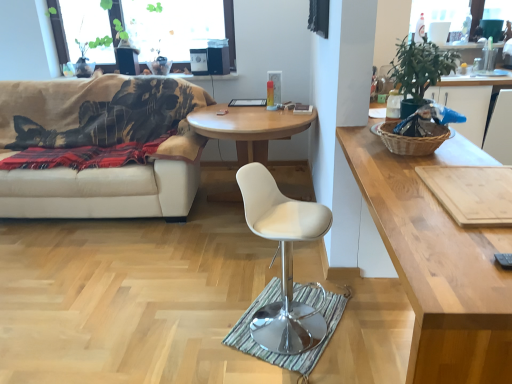
The width and height of the screenshot is (512, 384). What are the coordinates of `light brown wooden cutting board at right, the first coffee table in the right-to-left sequence` in the screenshot? It's located at (438, 263).

The image size is (512, 384). What do you see at coordinates (413, 139) in the screenshot?
I see `brown woven picnic basket at right` at bounding box center [413, 139].

Where is `brown woven picnic basket at right`? This screenshot has width=512, height=384. brown woven picnic basket at right is located at coordinates (413, 139).

The image size is (512, 384). Describe the element at coordinates (297, 301) in the screenshot. I see `textured woven mat at center` at that location.

What do you see at coordinates (230, 30) in the screenshot? The height and width of the screenshot is (384, 512). I see `transparent glass window at upper center` at bounding box center [230, 30].

I want to click on green leafy plant at upper right, so click(419, 71).

Describe the element at coordinates (419, 71) in the screenshot. I see `green leafy plant at upper right` at that location.

At what (x,y) coordinates should I click in order to perform the action: click on white leather stool at center. Please return your answer as a coordinate pair (x, y). The height and width of the screenshot is (384, 512). Looking at the image, I should click on (283, 260).

From a real-world perspective, which object rests below the other?

textured woven mat at center.

From the picture: Between white leather stool at center and textured woven mat at center, which one has less height?

textured woven mat at center is shorter.

From the image's perspective, is white leather stool at center over textured woven mat at center?

Indeed, from the image's perspective, white leather stool at center is shown above textured woven mat at center.

Which of these two, white leather stool at center or textured woven mat at center, is thinner?

Thinner between the two is white leather stool at center.

Is wooden round table at center, which ranks as the first coffee table in back-to-front order, situated inside transparent glass window at upper center or outside?

wooden round table at center, which ranks as the first coffee table in back-to-front order, cannot be found inside transparent glass window at upper center.

Considering the positions of objects wooden round table at center, which ranks as the first coffee table in back-to-front order, and transparent glass window at upper center in the image provided, who is more to the right, wooden round table at center, which ranks as the first coffee table in back-to-front order, or transparent glass window at upper center?

wooden round table at center, which ranks as the first coffee table in back-to-front order, is more to the right.

Looking at this image, does wooden round table at center, the second coffee table viewed from the right, have a lesser height compared to transparent glass window at upper center?

In fact, wooden round table at center, the second coffee table viewed from the right, may be taller than transparent glass window at upper center.

Locate an element on the screen. This screenshot has height=384, width=512. window screen above the wooden round table at center, the 1th coffee table viewed from the left (from the image's perspective) is located at coordinates (230, 30).

Where is `houseplant above the textured woven mat at center (from the image's perspective)`? The width and height of the screenshot is (512, 384). houseplant above the textured woven mat at center (from the image's perspective) is located at coordinates pos(419,71).

Between textured woven mat at center and green leafy plant at upper right, which one is positioned behind?

textured woven mat at center is behind.

Can you confirm if textured woven mat at center is positioned to the left of green leafy plant at upper right?

Yes.

Is green leafy plant at upper right located within textured woven mat at center?

No, green leafy plant at upper right is not inside textured woven mat at center.

From the image's perspective, would you say light brown wooden cutting board at right, the first coffee table in the right-to-left sequence, is positioned over wooden cutting board at right?

Actually, light brown wooden cutting board at right, the first coffee table in the right-to-left sequence, appears below wooden cutting board at right in the image.

From a real-world perspective, is light brown wooden cutting board at right, the first coffee table in the right-to-left sequence, physically located above or below wooden cutting board at right?

light brown wooden cutting board at right, the first coffee table in the right-to-left sequence, is situated lower than wooden cutting board at right in the real world.

Can you see light brown wooden cutting board at right, acting as the second coffee table starting from the left, touching wooden cutting board at right?

light brown wooden cutting board at right, acting as the second coffee table starting from the left, is not next to wooden cutting board at right, and they're not touching.

Is point (462, 307) farther from camera compared to point (450, 186)?

No, it is in front of (450, 186).

Is transparent glass window at upper center taller or shorter than beige fabric couch at left?

Clearly, transparent glass window at upper center is shorter compared to beige fabric couch at left.

Where is `studio couch below the transparent glass window at upper center (from a real-world perspective)`? The width and height of the screenshot is (512, 384). studio couch below the transparent glass window at upper center (from a real-world perspective) is located at coordinates (102, 145).

Does transparent glass window at upper center have a larger size compared to beige fabric couch at left?

Actually, transparent glass window at upper center might be smaller than beige fabric couch at left.

Looking at this image, is transparent glass window at upper center in front of or behind beige fabric couch at left in the image?

transparent glass window at upper center is behind beige fabric couch at left.

Which is more to the left, wooden cutting board at right or textured woven mat at center?

textured woven mat at center.

From the image's perspective, is wooden cutting board at right positioned above or below textured woven mat at center?

From the image's perspective, wooden cutting board at right appears above textured woven mat at center.

Is wooden cutting board at right in front of or behind textured woven mat at center in the image?

Clearly, wooden cutting board at right is in front of textured woven mat at center.

Is beige fabric couch at left in contact with brown woven picnic basket at right?

No, beige fabric couch at left is not touching brown woven picnic basket at right.

Is beige fabric couch at left bigger or smaller than brown woven picnic basket at right?

Considering their sizes, beige fabric couch at left takes up more space than brown woven picnic basket at right.

Between beige fabric couch at left and brown woven picnic basket at right, which one has more height?

beige fabric couch at left is taller.

Considering the positions of points (71, 181) and (410, 148), is point (71, 181) closer to camera compared to point (410, 148)?

No, (71, 181) is behind (410, 148).

The image size is (512, 384). What are the coordinates of `mat that appears on the right of white leather stool at center` in the screenshot? It's located at (297, 301).

I want to click on coffee table that is the 1st object located below the transparent glass window at upper center (from the image's perspective), so click(249, 128).

When comparing their distances from brown woven picnic basket at right, does wooden cutting board at right or wooden round table at center, which ranks as the first coffee table in back-to-front order, seem closer?

Based on the image, wooden cutting board at right appears to be nearer to brown woven picnic basket at right.

Based on their spatial positions, is brown woven picnic basket at right or wooden cutting board at right further from wooden round table at center, which ranks as the first coffee table in back-to-front order?

Among the two, wooden cutting board at right is located further to wooden round table at center, which ranks as the first coffee table in back-to-front order.

From the image, which object appears to be farther from wooden round table at center, the 1th coffee table viewed from the left, green leafy plant at upper right or textured woven mat at center?

textured woven mat at center.

Looking at the image, which one is located further to wooden cutting board at right, light brown wooden cutting board at right, which ranks as the 1th coffee table in front-to-back order, or brown woven picnic basket at right?

brown woven picnic basket at right is further to wooden cutting board at right.

Estimate the real-world distances between objects in this image. Which object is closer to wooden cutting board at right, textured woven mat at center or green leafy plant at upper right?

The object closer to wooden cutting board at right is green leafy plant at upper right.

From the image, which object appears to be nearer to beige fabric couch at left, transparent glass window at upper center or green leafy plant at upper right?

Among the two, transparent glass window at upper center is located nearer to beige fabric couch at left.

Which object lies nearer to the anchor point wooden round table at center, which ranks as the first coffee table in back-to-front order, brown woven picnic basket at right or transparent glass window at upper center?

The object closer to wooden round table at center, which ranks as the first coffee table in back-to-front order, is transparent glass window at upper center.

From the image, which object appears to be farther from wooden cutting board at right, wooden round table at center, which ranks as the first coffee table in back-to-front order, or transparent glass window at upper center?

Among the two, transparent glass window at upper center is located further to wooden cutting board at right.

Locate an element on the screen. picnic basket positioned between wooden cutting board at right and green leafy plant at upper right from near to far is located at coordinates 413,139.

You are a GUI agent. You are given a task and a screenshot of the screen. Output one action in this format:
    pyautogui.click(x=<x>, y=<y>)
    Task: Click on the plank positioned between light brown wooden cutting board at right, the first coffee table in the right-to-left sequence, and green leafy plant at upper right from near to far
    This screenshot has width=512, height=384.
    Given the screenshot: What is the action you would take?
    pyautogui.click(x=472, y=193)

The image size is (512, 384). Find the location of `picnic basket located between light brown wooden cutting board at right, acting as the second coffee table starting from the left, and textured woven mat at center in the depth direction`. picnic basket located between light brown wooden cutting board at right, acting as the second coffee table starting from the left, and textured woven mat at center in the depth direction is located at coordinates (413, 139).

Find the location of a particular element. This screenshot has height=384, width=512. mat between beige fabric couch at left and light brown wooden cutting board at right, the 2th coffee table in the back-to-front sequence is located at coordinates (297, 301).